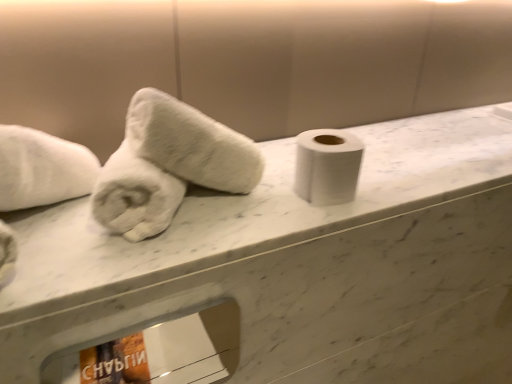
This screenshot has height=384, width=512. I want to click on free space to the right of white fluffy towel at left, positioned as the first towel in left-to-right order, so click(261, 206).